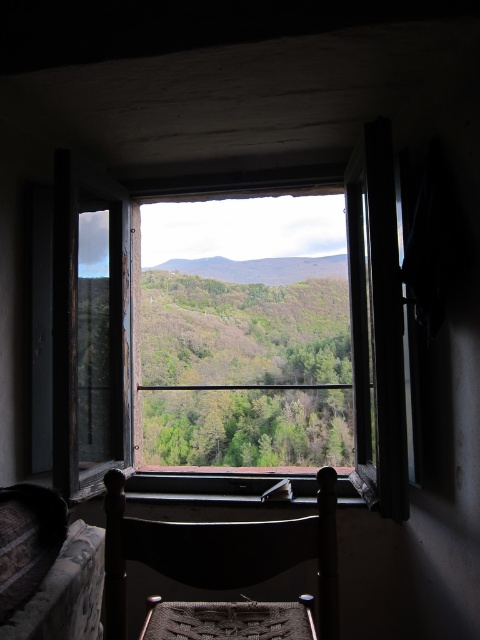
You are standing in a room with a wooden window at center. A friend is outside at point (230,337). Where exactly is your friend located relative to the wooden window at center?

Your friend is located exactly at the wooden window at center.

In the scene shown: You are sitting in the room and want to look outside through the wooden window at center. Since you are sitting on the dark wood chair at center, can you see over the top of the chair to the window?

The wooden window at center has a greater height compared to dark wood chair at center. Since the window is taller than the chair, you can see over the top of the dark wood chair at center to look through the wooden window at center.